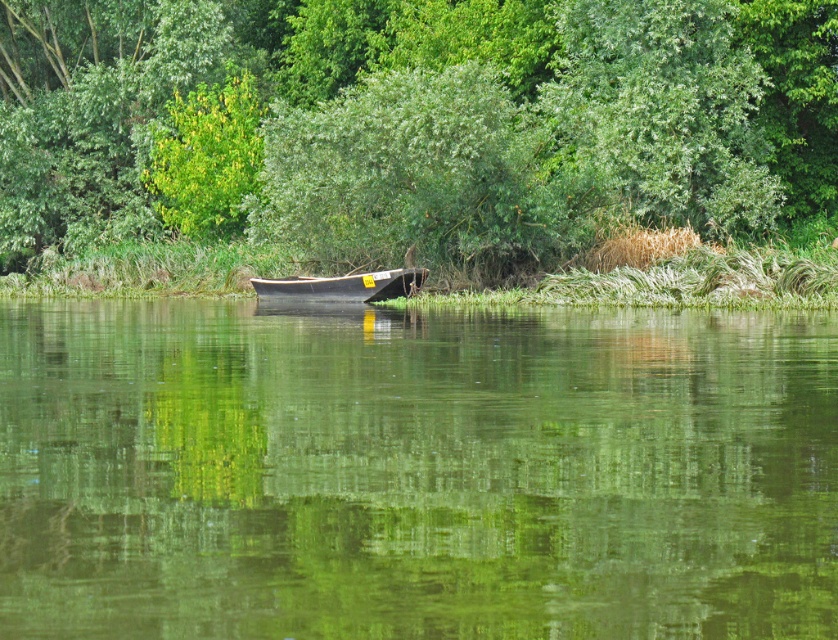
Question: Estimate the real-world distances between objects in this image. Which object is farther from the green leafy tree at center?

Choices:
 (A) wooden boat at center
 (B) green smooth water at center

Answer: (B)

Question: Is green smooth water at center closer to the viewer compared to wooden boat at center?

Choices:
 (A) yes
 (B) no

Answer: (A)

Question: Does green leafy tree at center have a greater width compared to wooden boat at center?

Choices:
 (A) no
 (B) yes

Answer: (B)

Question: Which point is closer to the camera?

Choices:
 (A) (269, 298)
 (B) (577, 493)
 (C) (241, 173)

Answer: (B)

Question: Which point is farther to the camera?

Choices:
 (A) (288, 284)
 (B) (419, 132)
 (C) (345, 344)

Answer: (A)

Question: Is green smooth water at center further to the viewer compared to wooden boat at center?

Choices:
 (A) yes
 (B) no

Answer: (B)